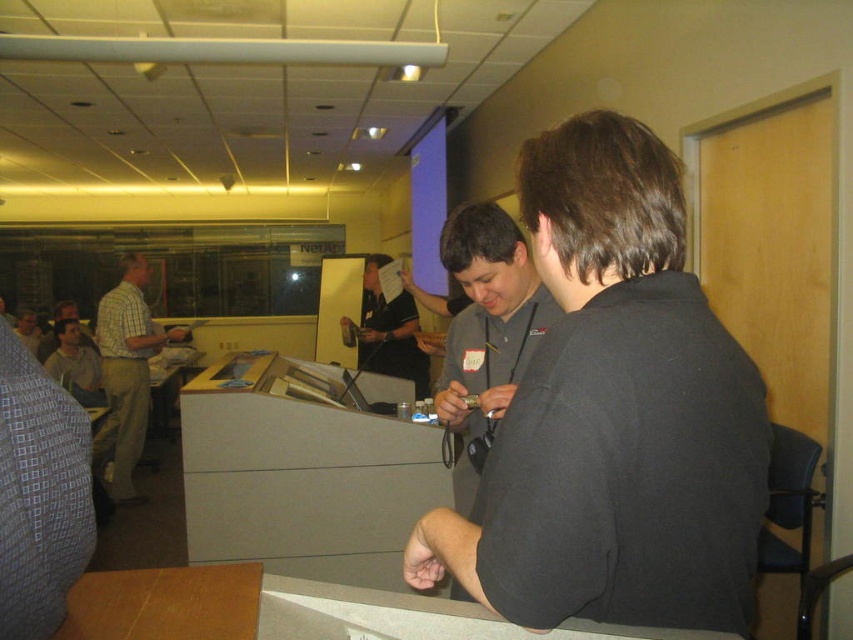
You are standing in the room and want to reach the point at coordinates (115,605). If your arm is 28 inches long, can you reach it without moving?

The point at coordinates (115,605) is 28.68 inches away from the viewer. Since your arm is 28 inches long, you cannot reach it without moving.

What are the coordinates of the black shirt at center in the image?

The coordinates of the black shirt at center are at point (614, 413).

Consider the image. You are organizing a photo shoot and need to position two subjects based on their clothing. The black shirt at center and the light brown leather jacket at lower left must be placed in a layout where the smaller item is closer to the camera. Which clothing item should be positioned closer?

The black shirt at center should be positioned closer to the camera because it occupies less space than the light brown leather jacket at lower left, making it the smaller item.